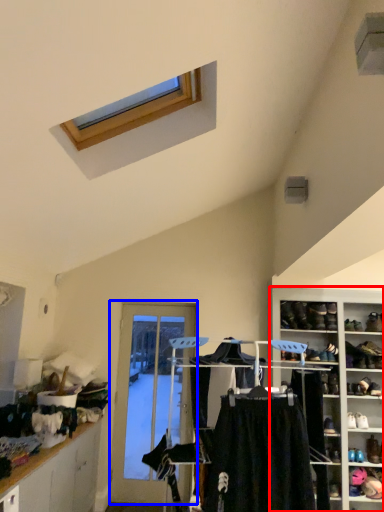
Question: Which object appears closest to the camera in this image, shelf (highlighted by a red box) or door (highlighted by a blue box)?

Choices:
 (A) shelf
 (B) door

Answer: (A)